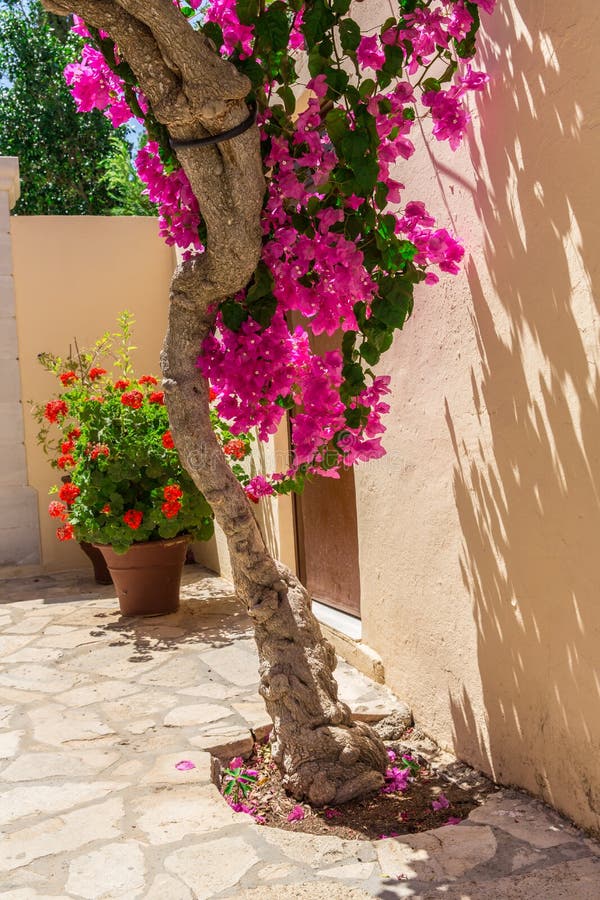
Image resolution: width=600 pixels, height=900 pixels. Find the location of `doorway`. doorway is located at coordinates (320, 532).